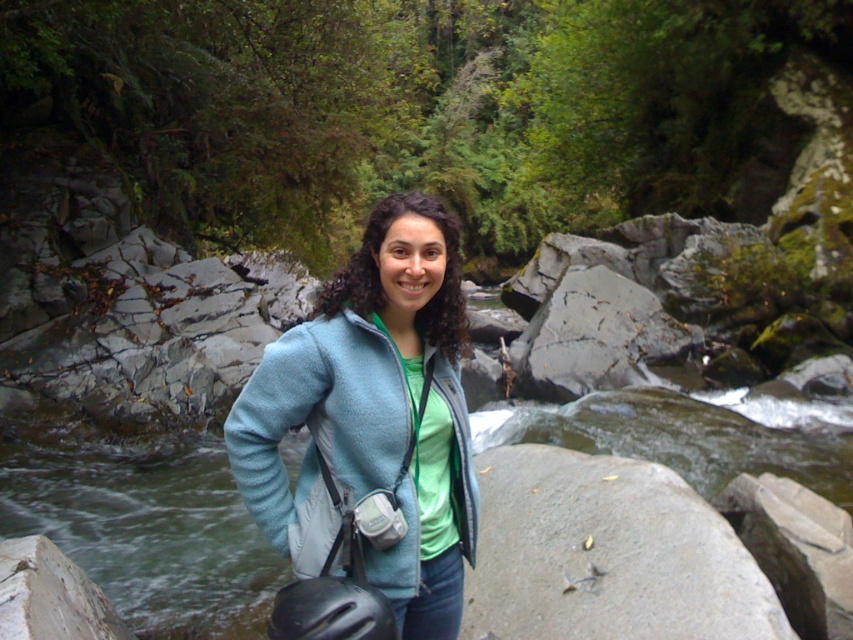
Question: Does gray smooth rock at center have a lesser width compared to gray smooth rock at lower left?

Choices:
 (A) yes
 (B) no

Answer: (B)

Question: Can you confirm if gray smooth rock at center is positioned below gray smooth rock at lower left?

Choices:
 (A) no
 (B) yes

Answer: (A)

Question: Is gray smooth rock at center further to camera compared to light blue fleece jacket at center?

Choices:
 (A) yes
 (B) no

Answer: (A)

Question: Considering the real-world distances, which object is closest to the gray smooth rock at center?

Choices:
 (A) light blue fleece jacket at center
 (B) gray smooth rock at lower left

Answer: (A)

Question: Estimate the real-world distances between objects in this image. Which object is closer to the gray smooth rock at lower left?

Choices:
 (A) gray smooth rock at center
 (B) light blue fleece jacket at center

Answer: (B)

Question: Which object is farther from the camera taking this photo?

Choices:
 (A) gray smooth rock at lower left
 (B) light blue fleece jacket at center
 (C) gray smooth rock at center

Answer: (C)